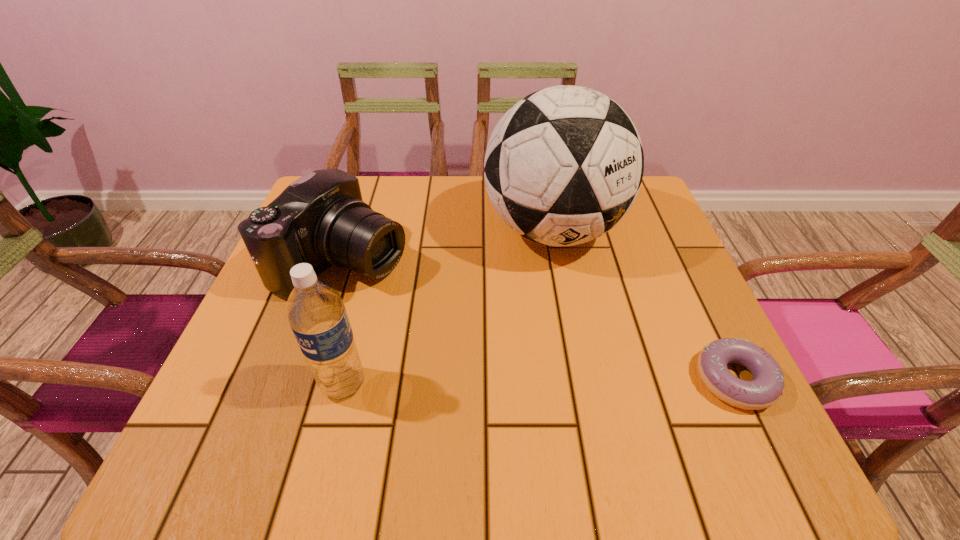
Where is `free space on the desktop that is between the third shortest object and the rightmost object and is positioned on the lens of the third tallest object`? This screenshot has height=540, width=960. free space on the desktop that is between the third shortest object and the rightmost object and is positioned on the lens of the third tallest object is located at coordinates (588, 381).

The height and width of the screenshot is (540, 960). In order to click on vacant space on the desktop that is between the second tallest object and the doughnut and is positioned on the surface of the soccer ball where the brand logo is visible in this screenshot , I will do `click(588, 381)`.